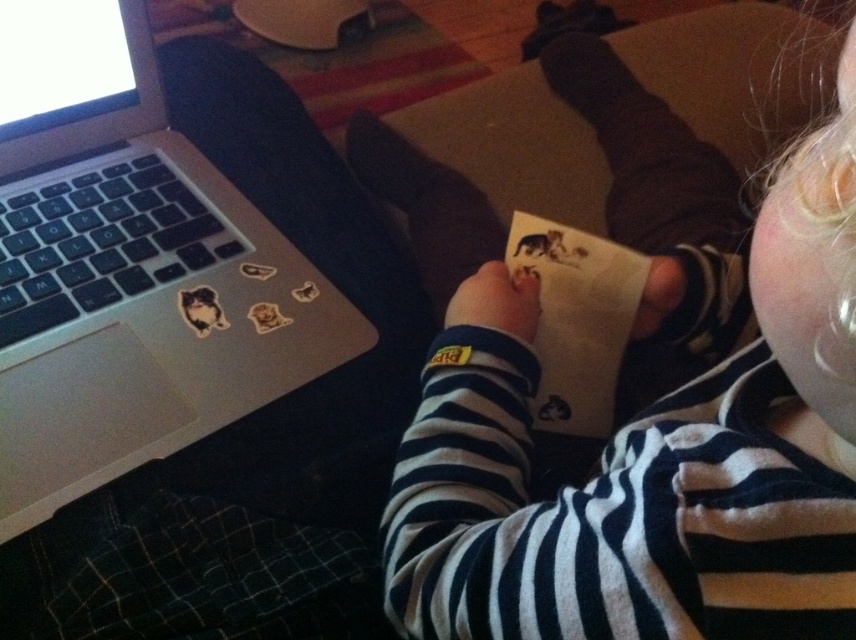
Consider the image. Is white striped shirt at center positioned at the back of white paper at center?

No, white striped shirt at center is in front of white paper at center.

Between white striped shirt at center and white paper at center, which one appears on the left side from the viewer's perspective?

white paper at center is more to the left.

Is point (492, 541) positioned after point (575, 269)?

No, it is in front of (575, 269).

In order to click on white striped shirt at center in this screenshot , I will do `click(652, 445)`.

Which is below, white striped shirt at center or silver metallic laptop at left?

silver metallic laptop at left is lower down.

Does white striped shirt at center have a larger size compared to silver metallic laptop at left?

Yes, white striped shirt at center is bigger than silver metallic laptop at left.

Who is more forward, (575, 602) or (64, 385)?

Point (575, 602) is in front.

At what (x,y) coordinates should I click in order to perform the action: click on white striped shirt at center. Please return your answer as a coordinate pair (x, y). Looking at the image, I should click on (652, 445).

Does silver metallic laptop at left appear on the left side of white paper at center?

Indeed, silver metallic laptop at left is positioned on the left side of white paper at center.

From the picture: Is silver metallic laptop at left above white paper at center?

Correct, silver metallic laptop at left is located above white paper at center.

Is point (103, 360) positioned after point (617, 260)?

No, it is not.

The width and height of the screenshot is (856, 640). I want to click on silver metallic laptop at left, so click(x=128, y=268).